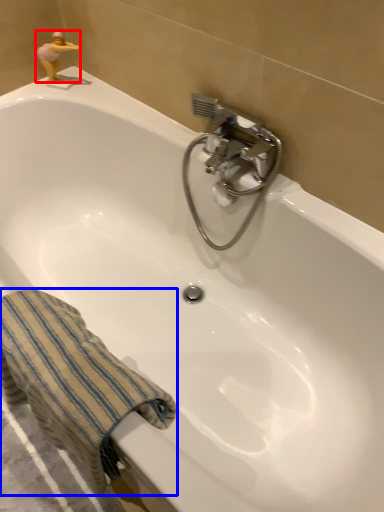
Question: Which object appears farthest to the camera in this image, miniature (highlighted by a red box) or towel/napkin (highlighted by a blue box)?

Choices:
 (A) miniature
 (B) towel/napkin

Answer: (A)